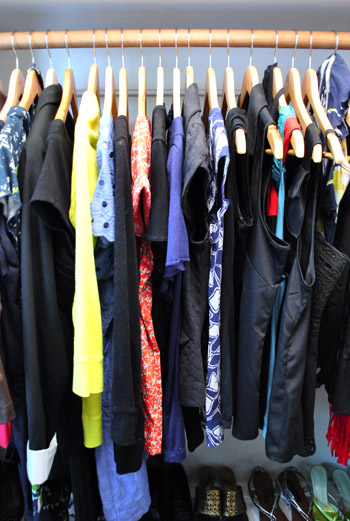
The width and height of the screenshot is (350, 521). Find the location of `white shoe shelf`. white shoe shelf is located at coordinates (251, 512).